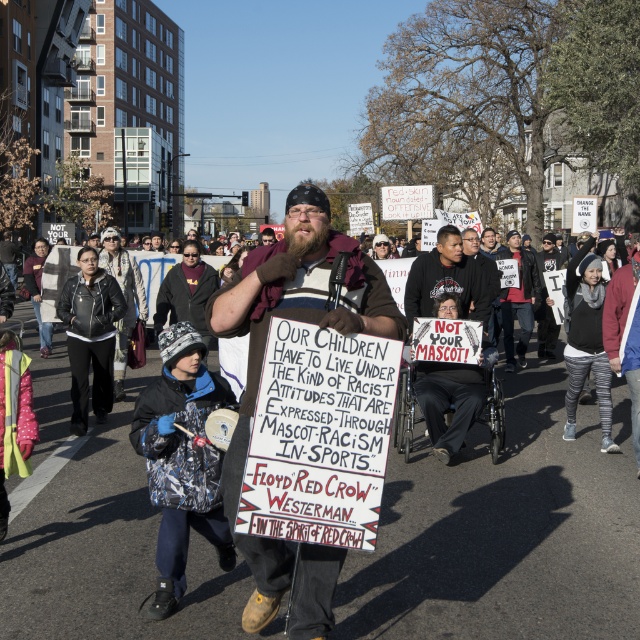
From the picture: Is brown leather jacket at center taller than black fabric shirt at center?

Yes.

Is point (372, 273) more distant than point (433, 291)?

No.

The image size is (640, 640). Describe the element at coordinates (296, 301) in the screenshot. I see `brown leather jacket at center` at that location.

The width and height of the screenshot is (640, 640). What are the coordinates of `brown leather jacket at center` in the screenshot? It's located at (296, 301).